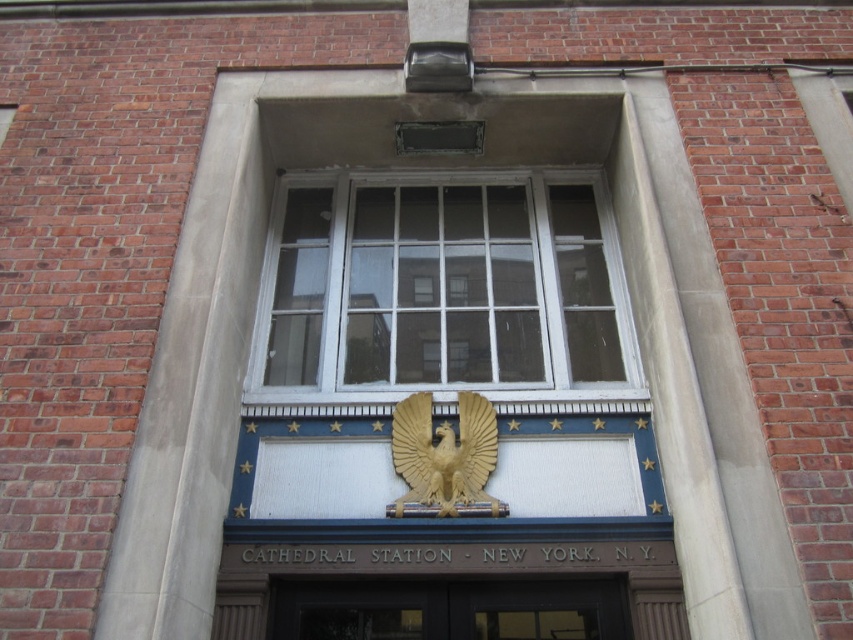
Question: Is white wood window at center closer to the viewer compared to matte black door at center?

Choices:
 (A) yes
 (B) no

Answer: (B)

Question: Which of the following is the closest to the observer?

Choices:
 (A) (383, 621)
 (B) (436, 333)

Answer: (A)

Question: Is white wood window at center in front of matte black door at center?

Choices:
 (A) no
 (B) yes

Answer: (A)

Question: Which of the following is the farthest from the observer?

Choices:
 (A) (587, 209)
 (B) (535, 588)

Answer: (A)

Question: Does white wood window at center come in front of matte black door at center?

Choices:
 (A) yes
 (B) no

Answer: (B)

Question: Which object is farther from the camera taking this photo?

Choices:
 (A) matte black door at center
 (B) white wood window at center

Answer: (B)